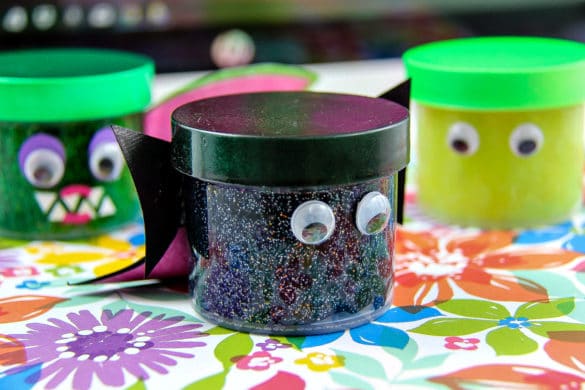
I want to click on table, so click(x=347, y=84).